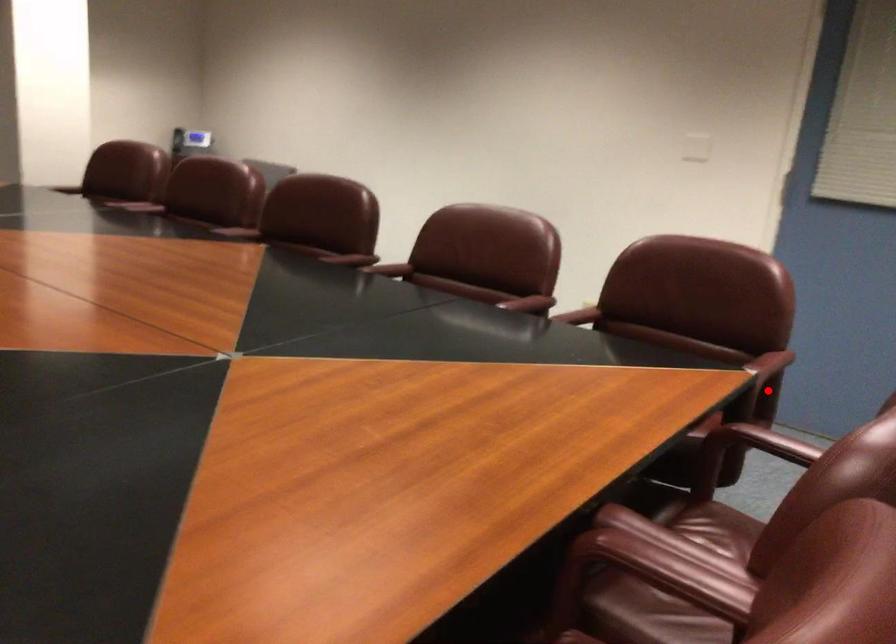
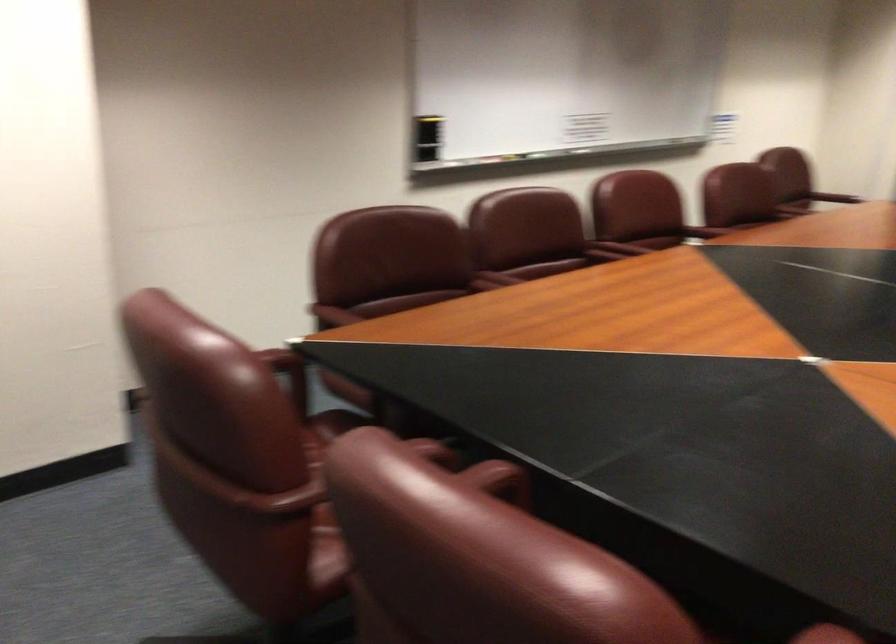
In the second image, find the point that corresponds to the highlighted location in the first image.

(289, 374)